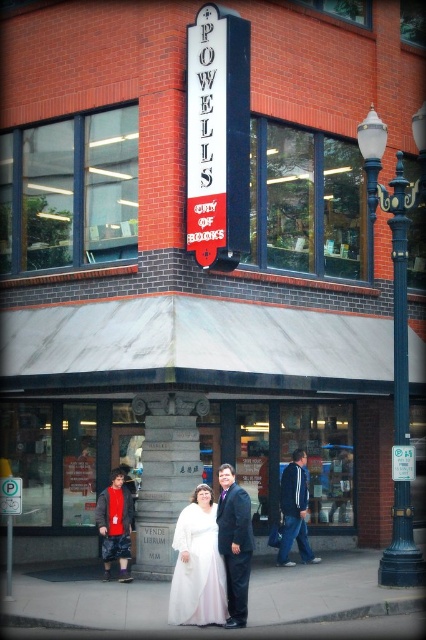
Does point (218, 572) come closer to viewer compared to point (127, 532)?

Yes, point (218, 572) is in front of point (127, 532).

From the picture: Is white satin dress at center to the right of white satin robe at lower left from the viewer's perspective?

Yes, white satin dress at center is to the right of white satin robe at lower left.

Identify the location of white satin dress at center. (198, 566).

Locate an element on the screen. The width and height of the screenshot is (426, 640). white satin dress at center is located at coordinates point(198,566).

Who is positioned more to the left, white satin dress at center or blue denim jeans at center?

Positioned to the left is white satin dress at center.

Which is behind, point (207, 496) or point (299, 508)?

Point (299, 508)

This screenshot has width=426, height=640. I want to click on white satin dress at center, so click(x=198, y=566).

Is matte black suit at center shorter than white satin robe at lower left?

Incorrect, matte black suit at center's height does not fall short of white satin robe at lower left's.

Is matte black suit at center below white satin robe at lower left?

Incorrect, matte black suit at center is not positioned below white satin robe at lower left.

Which is in front, point (227, 572) or point (103, 516)?

Point (227, 572) is more forward.

Locate an element on the screen. The height and width of the screenshot is (640, 426). matte black suit at center is located at coordinates (235, 544).